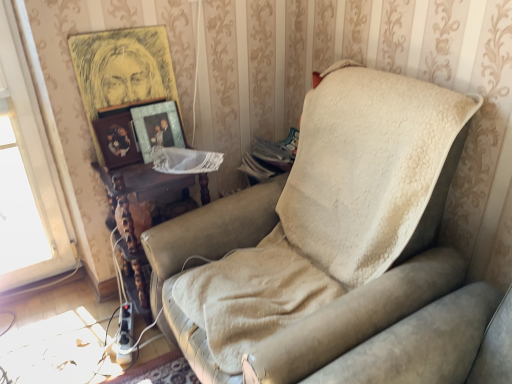
The image size is (512, 384). In order to click on woodenmaterial/texturetable at center in this screenshot , I will do `click(149, 215)`.

Measure the distance between metallic gold picture frame at upper center, the second picture frame when ordered from top to bottom, and camera.

metallic gold picture frame at upper center, the second picture frame when ordered from top to bottom, and camera are 5.06 feet apart from each other.

How much space does wooden picture frame at upper left, arranged as the third picture frame when ordered from the bottom, occupy horizontally?

wooden picture frame at upper left, arranged as the third picture frame when ordered from the bottom, is 2.24 inches wide.

Describe the element at coordinates (121, 69) in the screenshot. This screenshot has height=384, width=512. I see `wooden picture frame at upper left, the first picture frame positioned from the top` at that location.

Describe the element at coordinates (117, 140) in the screenshot. Image resolution: width=512 pixels, height=384 pixels. I see `woodenobject at left, acting as the first picture frame starting from the bottom` at that location.

Where is `woodenobject at left, the 3th picture frame viewed from the top`? This screenshot has width=512, height=384. woodenobject at left, the 3th picture frame viewed from the top is located at coordinates pos(117,140).

You are a GUI agent. You are given a task and a screenshot of the screen. Output one action in this format:
    pyautogui.click(x=<x>, y=<y>)
    Task: Click on the woodenmaterial/texturetable at center
    
    Given the screenshot: What is the action you would take?
    pyautogui.click(x=149, y=215)

Is leather studio couch at center positioned far away from metallic gold picture frame at upper center, placed as the 2th picture frame when sorted from bottom to top?

That's not correct — leather studio couch at center is a little close to metallic gold picture frame at upper center, placed as the 2th picture frame when sorted from bottom to top.

Measure the distance from leather studio couch at center to metallic gold picture frame at upper center, placed as the 2th picture frame when sorted from bottom to top.

The distance of leather studio couch at center from metallic gold picture frame at upper center, placed as the 2th picture frame when sorted from bottom to top, is 26.35 inches.

Does leather studio couch at center have a lesser height compared to metallic gold picture frame at upper center, the second picture frame when ordered from top to bottom?

No.

What's the angular difference between leather studio couch at center and metallic gold picture frame at upper center, the second picture frame when ordered from top to bottom,'s facing directions?

The angle between the facing direction of leather studio couch at center and the facing direction of metallic gold picture frame at upper center, the second picture frame when ordered from top to bottom, is 88.5 degrees.

Visually, is wooden picture frame at upper left, arranged as the third picture frame when ordered from the bottom, positioned to the left or to the right of woodenmaterial/texturetable at center?

In the image, wooden picture frame at upper left, arranged as the third picture frame when ordered from the bottom, appears on the left side of woodenmaterial/texturetable at center.

You are a GUI agent. You are given a task and a screenshot of the screen. Output one action in this format:
    pyautogui.click(x=<x>, y=<y>)
    Task: Click on the 1st picture frame counting from the left of the woodenmaterial/texturetable at center
    Image resolution: width=512 pixels, height=384 pixels.
    Given the screenshot: What is the action you would take?
    pyautogui.click(x=121, y=69)

Does wooden picture frame at upper left, arranged as the third picture frame when ordered from the bottom, touch woodenmaterial/texturetable at center?

They are not placed beside each other.

Could you tell me if metallic gold picture frame at upper center, placed as the 2th picture frame when sorted from bottom to top, is turned towards woodenobject at left, acting as the first picture frame starting from the bottom?

→ No.

Is there a large distance between metallic gold picture frame at upper center, placed as the 2th picture frame when sorted from bottom to top, and woodenobject at left, acting as the first picture frame starting from the bottom?

No, there isn't a large distance between metallic gold picture frame at upper center, placed as the 2th picture frame when sorted from bottom to top, and woodenobject at left, acting as the first picture frame starting from the bottom.

From the image's perspective, which object appears higher, metallic gold picture frame at upper center, placed as the 2th picture frame when sorted from bottom to top, or woodenobject at left, the 3th picture frame viewed from the top?

From the image's view, metallic gold picture frame at upper center, placed as the 2th picture frame when sorted from bottom to top, is above.

Considering the sizes of objects metallic gold picture frame at upper center, the second picture frame when ordered from top to bottom, and woodenobject at left, the 3th picture frame viewed from the top, in the image provided, who is bigger, metallic gold picture frame at upper center, the second picture frame when ordered from top to bottom, or woodenobject at left, the 3th picture frame viewed from the top,?

Bigger between the two is metallic gold picture frame at upper center, the second picture frame when ordered from top to bottom.

I want to click on picture frame lying on the left of wooden picture frame at upper left, arranged as the third picture frame when ordered from the bottom, so click(117, 140).

From the image's perspective, is woodenobject at left, acting as the first picture frame starting from the bottom, on wooden picture frame at upper left, arranged as the third picture frame when ordered from the bottom?

Incorrect, from the image's perspective, woodenobject at left, acting as the first picture frame starting from the bottom, is lower than wooden picture frame at upper left, arranged as the third picture frame when ordered from the bottom.

Is woodenobject at left, the 3th picture frame viewed from the top, to the right of wooden picture frame at upper left, arranged as the third picture frame when ordered from the bottom, from the viewer's perspective?

Incorrect, woodenobject at left, the 3th picture frame viewed from the top, is not on the right side of wooden picture frame at upper left, arranged as the third picture frame when ordered from the bottom.

From a real-world perspective, which object stands above the other?

From a 3D spatial view, wooden picture frame at upper left, arranged as the third picture frame when ordered from the bottom, is above.

From the image's perspective, who appears lower, woodenobject at left, acting as the first picture frame starting from the bottom, or metallic gold picture frame at upper center, the second picture frame when ordered from top to bottom?

woodenobject at left, acting as the first picture frame starting from the bottom, from the image's perspective.

From the picture: Could you measure the distance between woodenobject at left, the 3th picture frame viewed from the top, and metallic gold picture frame at upper center, the second picture frame when ordered from top to bottom?

woodenobject at left, the 3th picture frame viewed from the top, is 3.27 inches away from metallic gold picture frame at upper center, the second picture frame when ordered from top to bottom.

Does woodenobject at left, acting as the first picture frame starting from the bottom, have a larger size compared to metallic gold picture frame at upper center, placed as the 2th picture frame when sorted from bottom to top?

Actually, woodenobject at left, acting as the first picture frame starting from the bottom, might be smaller than metallic gold picture frame at upper center, placed as the 2th picture frame when sorted from bottom to top.

Does woodenobject at left, acting as the first picture frame starting from the bottom, come in front of metallic gold picture frame at upper center, the second picture frame when ordered from top to bottom?

Yes, woodenobject at left, acting as the first picture frame starting from the bottom, is in front of metallic gold picture frame at upper center, the second picture frame when ordered from top to bottom.

Is metallic gold picture frame at upper center, the second picture frame when ordered from top to bottom, not inside woodenmaterial/texturetable at center?

Absolutely, metallic gold picture frame at upper center, the second picture frame when ordered from top to bottom, is external to woodenmaterial/texturetable at center.

Considering the sizes of objects metallic gold picture frame at upper center, the second picture frame when ordered from top to bottom, and woodenmaterial/texturetable at center in the image provided, who is shorter, metallic gold picture frame at upper center, the second picture frame when ordered from top to bottom, or woodenmaterial/texturetable at center?

With less height is metallic gold picture frame at upper center, the second picture frame when ordered from top to bottom.

Is metallic gold picture frame at upper center, the second picture frame when ordered from top to bottom, far away from woodenmaterial/texturetable at center?

No, metallic gold picture frame at upper center, the second picture frame when ordered from top to bottom, is in close proximity to woodenmaterial/texturetable at center.

Is point (156, 127) positioned after point (160, 187)?

That is True.

Are wooden picture frame at upper left, the first picture frame positioned from the top, and woodenobject at left, the 3th picture frame viewed from the top, making contact?

No, wooden picture frame at upper left, the first picture frame positioned from the top, is not making contact with woodenobject at left, the 3th picture frame viewed from the top.

From the image's perspective, starting from the woodenobject at left, the 3th picture frame viewed from the top, which picture frame is the 2nd one above? Please provide its 2D coordinates.

[(121, 69)]

Is wooden picture frame at upper left, arranged as the third picture frame when ordered from the bottom, in front of or behind woodenobject at left, acting as the first picture frame starting from the bottom, in the image?

wooden picture frame at upper left, arranged as the third picture frame when ordered from the bottom, is positioned closer to the viewer than woodenobject at left, acting as the first picture frame starting from the bottom.

At what (x,y) coordinates should I click in order to perform the action: click on the 2nd picture frame above the leather studio couch at center (from the image's perspective). Please return your answer as a coordinate pair (x, y). This screenshot has width=512, height=384. Looking at the image, I should click on (157, 127).

This screenshot has width=512, height=384. Find the location of `the 1st picture frame counting from the left side of the woodenmaterial/texturetable at center`. the 1st picture frame counting from the left side of the woodenmaterial/texturetable at center is located at coordinates (121, 69).

Based on their spatial positions, is metallic gold picture frame at upper center, placed as the 2th picture frame when sorted from bottom to top, or woodenobject at left, acting as the first picture frame starting from the bottom, closer to wooden picture frame at upper left, arranged as the third picture frame when ordered from the bottom?

Based on the image, metallic gold picture frame at upper center, placed as the 2th picture frame when sorted from bottom to top, appears to be nearer to wooden picture frame at upper left, arranged as the third picture frame when ordered from the bottom.

Based on their spatial positions, is leather studio couch at center or woodenmaterial/texturetable at center closer to metallic gold picture frame at upper center, placed as the 2th picture frame when sorted from bottom to top?

woodenmaterial/texturetable at center lies closer to metallic gold picture frame at upper center, placed as the 2th picture frame when sorted from bottom to top, than the other object.

Looking at the image, which one is located closer to wooden picture frame at upper left, the first picture frame positioned from the top, woodenmaterial/texturetable at center or metallic gold picture frame at upper center, placed as the 2th picture frame when sorted from bottom to top?

Based on the image, metallic gold picture frame at upper center, placed as the 2th picture frame when sorted from bottom to top, appears to be nearer to wooden picture frame at upper left, the first picture frame positioned from the top.

Considering their positions, is leather studio couch at center positioned further to woodenobject at left, acting as the first picture frame starting from the bottom, than woodenmaterial/texturetable at center?

Among the two, leather studio couch at center is located further to woodenobject at left, acting as the first picture frame starting from the bottom.

Which object lies further to the anchor point wooden picture frame at upper left, arranged as the third picture frame when ordered from the bottom, woodenmaterial/texturetable at center or woodenobject at left, acting as the first picture frame starting from the bottom?

The object further to wooden picture frame at upper left, arranged as the third picture frame when ordered from the bottom, is woodenmaterial/texturetable at center.

Estimate the real-world distances between objects in this image. Which object is further from wooden picture frame at upper left, arranged as the third picture frame when ordered from the bottom, leather studio couch at center or metallic gold picture frame at upper center, the second picture frame when ordered from top to bottom?

Among the two, leather studio couch at center is located further to wooden picture frame at upper left, arranged as the third picture frame when ordered from the bottom.

Estimate the real-world distances between objects in this image. Which object is further from metallic gold picture frame at upper center, the second picture frame when ordered from top to bottom, woodenobject at left, the 3th picture frame viewed from the top, or leather studio couch at center?

leather studio couch at center is further to metallic gold picture frame at upper center, the second picture frame when ordered from top to bottom.

When comparing their distances from woodenobject at left, acting as the first picture frame starting from the bottom, does wooden picture frame at upper left, arranged as the third picture frame when ordered from the bottom, or woodenmaterial/texturetable at center seem further?

Based on the image, woodenmaterial/texturetable at center appears to be further to woodenobject at left, acting as the first picture frame starting from the bottom.

Where is `picture frame between metallic gold picture frame at upper center, placed as the 2th picture frame when sorted from bottom to top, and woodenmaterial/texturetable at center, in the vertical direction`? picture frame between metallic gold picture frame at upper center, placed as the 2th picture frame when sorted from bottom to top, and woodenmaterial/texturetable at center, in the vertical direction is located at coordinates (117, 140).

The width and height of the screenshot is (512, 384). What are the coordinates of `table located between leather studio couch at center and metallic gold picture frame at upper center, the second picture frame when ordered from top to bottom, in the depth direction` in the screenshot? It's located at (149, 215).

What are the coordinates of `table positioned between leather studio couch at center and woodenobject at left, acting as the first picture frame starting from the bottom, from near to far` in the screenshot? It's located at (149, 215).

Find the location of `picture frame between leather studio couch at center and woodenmaterial/texturetable at center in the front-back direction`. picture frame between leather studio couch at center and woodenmaterial/texturetable at center in the front-back direction is located at coordinates (121, 69).